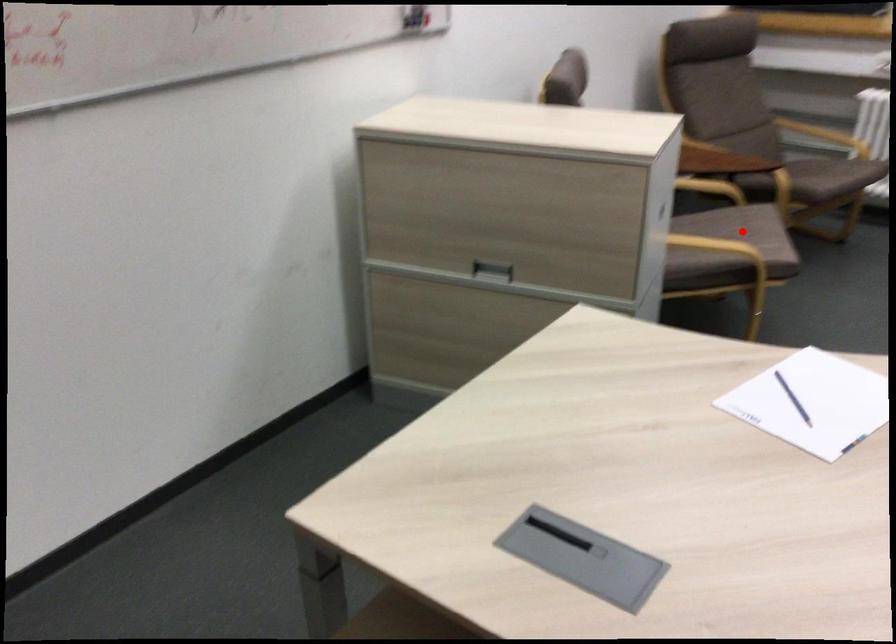
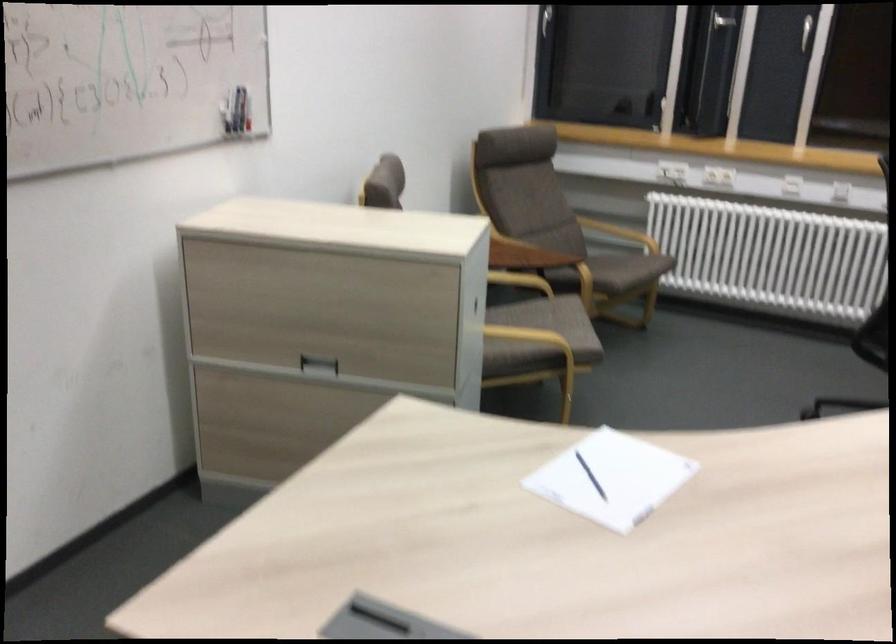
The point at the highlighted location is marked in the first image. Where is the corresponding point in the second image?

(552, 321)